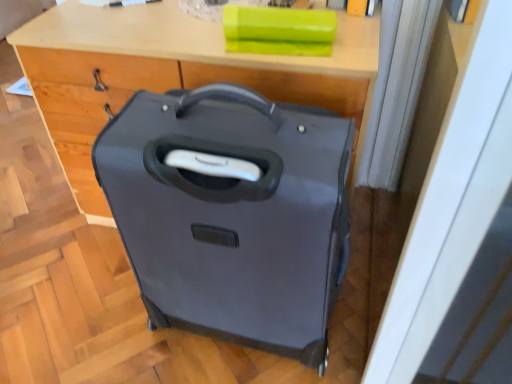
This screenshot has width=512, height=384. What do you see at coordinates (232, 214) in the screenshot? I see `matte black suitcase at center` at bounding box center [232, 214].

Identify the location of matte black suitcase at center. tap(232, 214).

Image resolution: width=512 pixels, height=384 pixels. Describe the element at coordinates (170, 73) in the screenshot. I see `matte wood computer desk at center` at that location.

Find the location of `matte wood computer desk at center`. matte wood computer desk at center is located at coordinates (170, 73).

What is the approximate width of matte wood computer desk at center?

20.19 inches.

Find the location of a particular element. The width and height of the screenshot is (512, 384). matte black suitcase at center is located at coordinates (232, 214).

Based on their positions, is matte black suitcase at center located to the left or right of matte wood computer desk at center?

Clearly, matte black suitcase at center is on the right of matte wood computer desk at center in the image.

Who is more distant, matte black suitcase at center or matte wood computer desk at center?

matte wood computer desk at center is further from the camera.

Does point (236, 274) come farther from viewer compared to point (245, 76)?

No, (236, 274) is closer to viewer.

From the image's perspective, is matte black suitcase at center positioned above or below matte wood computer desk at center?

matte black suitcase at center is below matte wood computer desk at center.

From a real-world perspective, which object rests below the other?

From a 3D spatial view, matte wood computer desk at center is below.

Considering the sizes of matte black suitcase at center and matte wood computer desk at center in the image, is matte black suitcase at center wider or thinner than matte wood computer desk at center?

Considering their sizes, matte black suitcase at center looks slimmer than matte wood computer desk at center.

Is matte black suitcase at center taller or shorter than matte wood computer desk at center?

Considering their sizes, matte black suitcase at center has more height than matte wood computer desk at center.

Based on their sizes in the image, would you say matte black suitcase at center is bigger or smaller than matte wood computer desk at center?

In the image, matte black suitcase at center appears to be smaller than matte wood computer desk at center.

Is matte black suitcase at center outside of matte wood computer desk at center?

A: That's correct, matte black suitcase at center is outside of matte wood computer desk at center.

Is matte black suitcase at center not close to matte wood computer desk at center?

No.

Looking at this image, is matte black suitcase at center aimed at matte wood computer desk at center?

No.

I want to click on suitcase that is in front of the matte wood computer desk at center, so click(x=232, y=214).

Which is more to the right, matte wood computer desk at center or matte black suitcase at center?

matte black suitcase at center is more to the right.

Is matte wood computer desk at center behind matte black suitcase at center?

Yes, matte wood computer desk at center is further from the viewer.

Which is more distant, (x=91, y=81) or (x=343, y=207)?

The point (x=91, y=81) is more distant.

From the image's perspective, which one is positioned lower, matte wood computer desk at center or matte black suitcase at center?

matte black suitcase at center, from the image's perspective.

From a real-world perspective, is matte wood computer desk at center positioned above or below matte black suitcase at center?

From a real-world perspective, matte wood computer desk at center is physically below matte black suitcase at center.

Does matte wood computer desk at center have a greater width compared to matte black suitcase at center?

Yes, matte wood computer desk at center is wider than matte black suitcase at center.

Does matte wood computer desk at center have a greater height compared to matte black suitcase at center?

Incorrect, the height of matte wood computer desk at center is not larger of that of matte black suitcase at center.

Which of these two, matte wood computer desk at center or matte black suitcase at center, is bigger?

A: With larger size is matte wood computer desk at center.

Is matte black suitcase at center surrounded by matte wood computer desk at center?

Definitely not — matte black suitcase at center is not inside matte wood computer desk at center.

Is matte wood computer desk at center positioned far away from matte black suitcase at center?

No, matte wood computer desk at center is not far away from matte black suitcase at center.

Is matte wood computer desk at center facing away from matte black suitcase at center?

No, matte wood computer desk at center is not facing the opposite direction of matte black suitcase at center.

In the image, there is a matte black suitcase at center. In order to click on computer desk above it (from the image's perspective) in this screenshot , I will do `click(170, 73)`.

I want to click on suitcase below the matte wood computer desk at center (from the image's perspective), so click(x=232, y=214).

Identify the location of computer desk lying above the matte black suitcase at center (from the image's perspective). This screenshot has width=512, height=384. pyautogui.click(x=170, y=73).